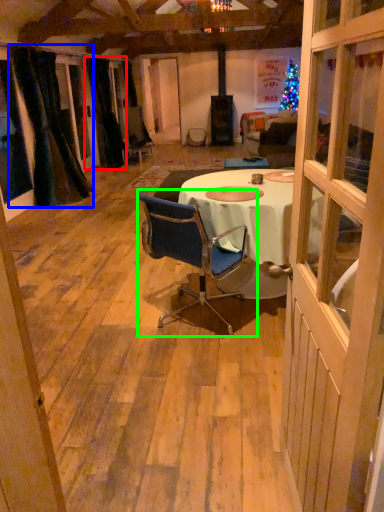
Question: Which object is positioned closest to curtain (highlighted by a red box)? Select from curtain (highlighted by a blue box) and chair (highlighted by a green box).

Choices:
 (A) curtain
 (B) chair

Answer: (A)